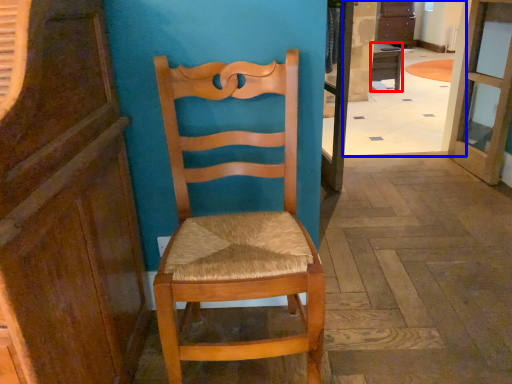
Question: Which of the following is the closest to the observer, desk (highlighted by a red box) or corridor (highlighted by a blue box)?

Choices:
 (A) desk
 (B) corridor

Answer: (B)